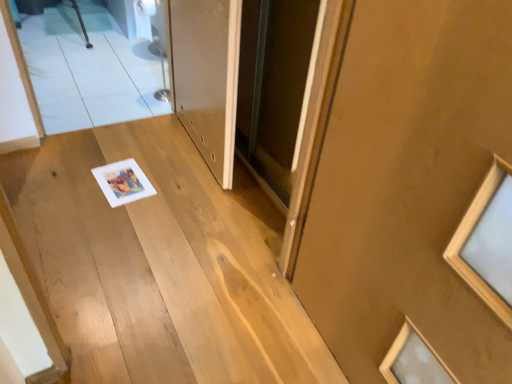
Question: Is matte brown door at center, the second door positioned from the left, a part of wooden stairs at center?

Choices:
 (A) yes
 (B) no

Answer: (B)

Question: Is wooden stairs at center taller than matte brown door at center, which is the first door in right-to-left order?

Choices:
 (A) no
 (B) yes

Answer: (A)

Question: Is wooden stairs at center smaller than matte brown door at center, which is the first door in right-to-left order?

Choices:
 (A) no
 (B) yes

Answer: (A)

Question: Is wooden stairs at center shorter than matte brown door at center, which is the first door in right-to-left order?

Choices:
 (A) no
 (B) yes

Answer: (B)

Question: From the image's perspective, is wooden stairs at center on top of matte brown door at center, the second door in the back-to-front sequence?

Choices:
 (A) yes
 (B) no

Answer: (A)

Question: From their relative heights in the image, would you say matte brown door at center, the second door positioned from the left, is taller or shorter than white glossy door at center, the 2th door positioned from the right?

Choices:
 (A) short
 (B) tall

Answer: (B)

Question: In the image, is matte brown door at center, the second door in the back-to-front sequence, positioned in front of or behind white glossy door at center, the 2th door positioned from the right?

Choices:
 (A) front
 (B) behind

Answer: (A)

Question: Is point (365, 100) closer or farther from the camera than point (234, 82)?

Choices:
 (A) closer
 (B) farther

Answer: (A)

Question: Based on their sizes in the image, would you say matte brown door at center, the second door in the back-to-front sequence, is bigger or smaller than white glossy door at center, which ranks as the second door in front-to-back order?

Choices:
 (A) small
 (B) big

Answer: (B)

Question: Is white glossy door at center, the 2th door positioned from the right, bigger or smaller than matte brown door at center, which is the first door in right-to-left order?

Choices:
 (A) big
 (B) small

Answer: (B)

Question: Looking at their shapes, would you say white glossy door at center, the 2th door positioned from the right, is wider or thinner than matte brown door at center, which is the first door in right-to-left order?

Choices:
 (A) thin
 (B) wide

Answer: (B)

Question: Considering the relative positions of white glossy door at center, which is the 1th door from back to front, and matte brown door at center, which is the first door in right-to-left order, in the image provided, is white glossy door at center, which is the 1th door from back to front, to the left or to the right of matte brown door at center, which is the first door in right-to-left order,?

Choices:
 (A) left
 (B) right

Answer: (A)

Question: Is white glossy door at center, marked as the 1th door in a left-to-right arrangement, inside or outside of matte brown door at center, the second door positioned from the left?

Choices:
 (A) inside
 (B) outside

Answer: (B)

Question: From the image's perspective, is white glossy door at center, which ranks as the second door in front-to-back order, positioned above or below wooden stairs at center?

Choices:
 (A) above
 (B) below

Answer: (A)

Question: Is white glossy door at center, the 2th door positioned from the right, spatially inside wooden stairs at center, or outside of it?

Choices:
 (A) outside
 (B) inside

Answer: (A)